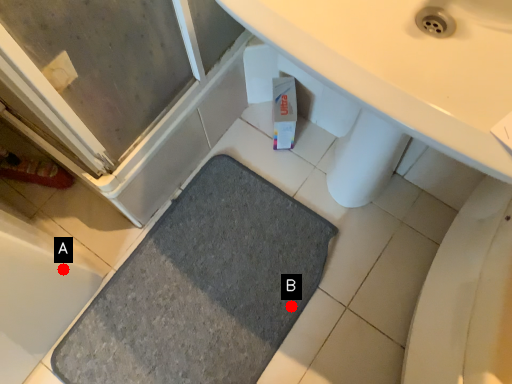
Question: Two points are circled on the image, labeled by A and B beside each circle. Which point is farther from the camera taking this photo?

Choices:
 (A) A is further
 (B) B is further

Answer: (B)